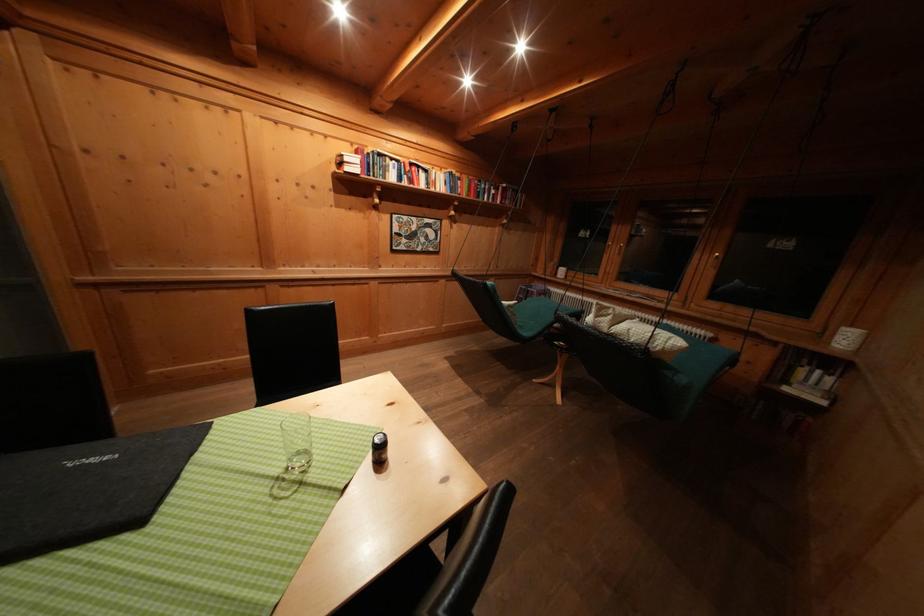
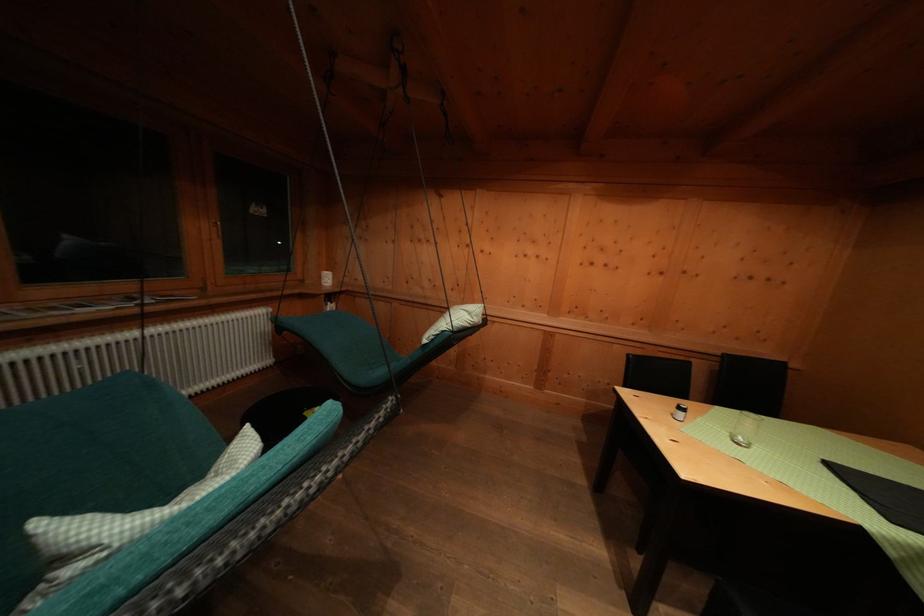
The point at (819, 377) is marked in the first image. Where is the corresponding point in the second image?

(333, 310)